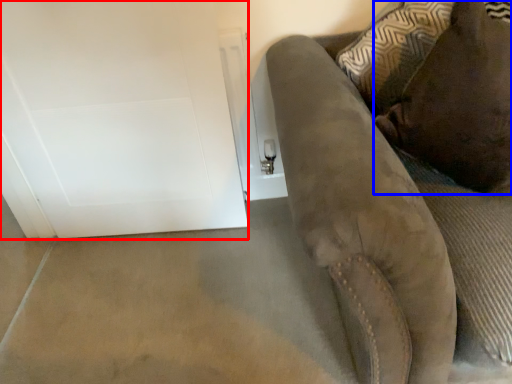
Question: Which of the following is the farthest to the observer, glass door (highlighted by a red box) or pillow (highlighted by a blue box)?

Choices:
 (A) glass door
 (B) pillow

Answer: (A)